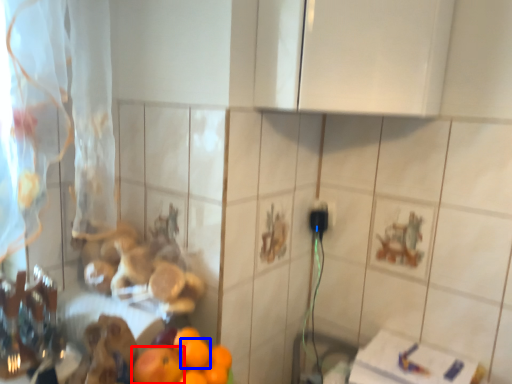
Question: Which object appears farthest to the camera in this image, orange (highlighted by a red box) or orange (highlighted by a blue box)?

Choices:
 (A) orange
 (B) orange

Answer: (B)